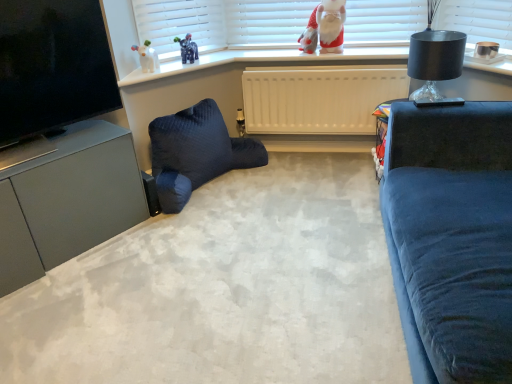
The image size is (512, 384). In order to click on free space in front of satin grey cabinet at lower left in this screenshot , I will do point(71,306).